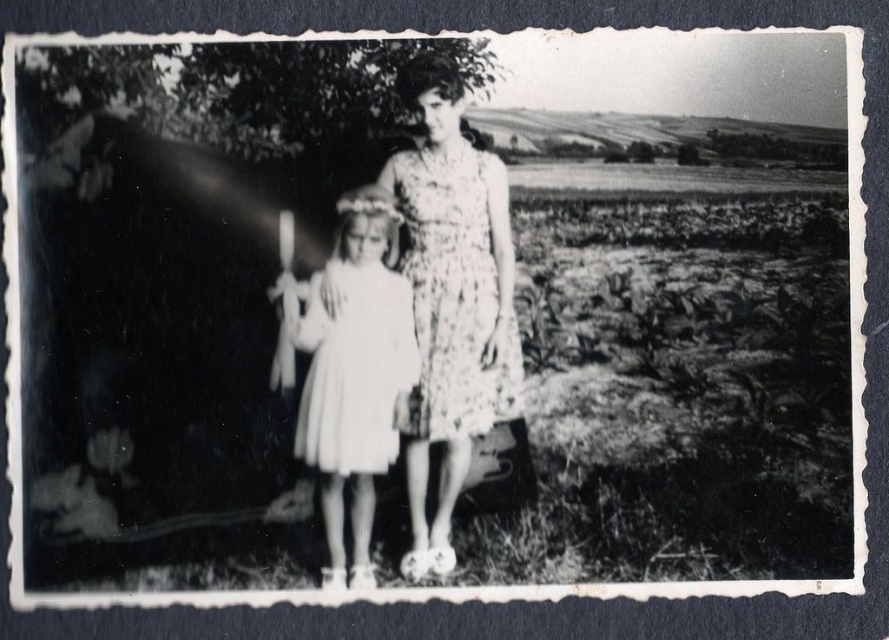
Question: Does white satin dress at center appear under floral-patterned fabric dress at center?

Choices:
 (A) yes
 (B) no

Answer: (A)

Question: Which point is farther to the camera?

Choices:
 (A) floral-patterned fabric dress at center
 (B) floral-patterned dress at center
 (C) white satin dress at center

Answer: (A)

Question: Does floral-patterned dress at center come in front of floral-patterned fabric dress at center?

Choices:
 (A) yes
 (B) no

Answer: (A)

Question: Which object is closer to the camera taking this photo?

Choices:
 (A) floral-patterned fabric dress at center
 (B) floral-patterned dress at center
 (C) white satin dress at center

Answer: (C)

Question: Can you confirm if floral-patterned dress at center is positioned below floral-patterned fabric dress at center?

Choices:
 (A) no
 (B) yes

Answer: (B)

Question: Based on their relative distances, which object is farther from the white satin dress at center?

Choices:
 (A) floral-patterned fabric dress at center
 (B) floral-patterned dress at center

Answer: (A)